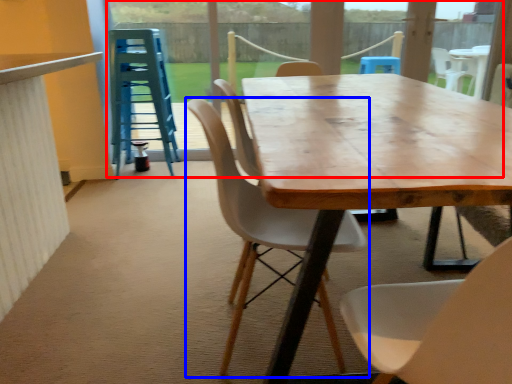
Question: Which of the following is the closest to the observer, glass door (highlighted by a red box) or chair (highlighted by a blue box)?

Choices:
 (A) glass door
 (B) chair

Answer: (B)